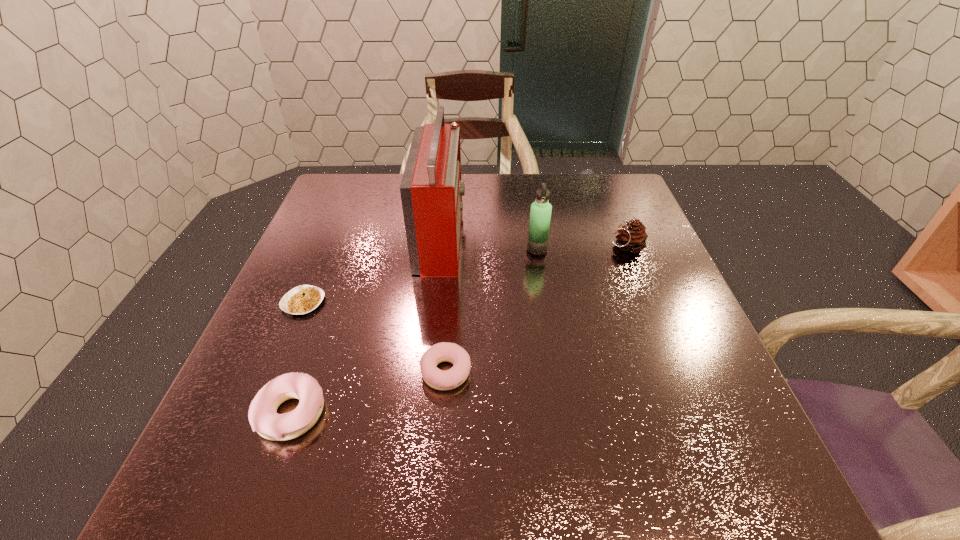
The height and width of the screenshot is (540, 960). Identify the location of vacant area that lies between the fourth shortest object and the shortest object. (465, 274).

You are a GUI agent. You are given a task and a screenshot of the screen. Output one action in this format:
    pyautogui.click(x=<x>, y=<y>)
    Task: Click on the free space between the right doughnut and the shortest object
    Image resolution: width=960 pixels, height=540 pixels.
    Given the screenshot: What is the action you would take?
    pyautogui.click(x=374, y=337)

Image resolution: width=960 pixels, height=540 pixels. Find the location of `vacant area that lies between the rightmost object and the legume`. vacant area that lies between the rightmost object and the legume is located at coordinates (465, 274).

The height and width of the screenshot is (540, 960). In order to click on free space that is in between the fifth tallest object and the thermos bottle in this screenshot , I will do `click(492, 310)`.

Where is `free spot between the taller doughnut and the tallest object`? The width and height of the screenshot is (960, 540). free spot between the taller doughnut and the tallest object is located at coordinates (366, 324).

This screenshot has height=540, width=960. I want to click on free spot between the second tallest object and the rightmost object, so click(x=581, y=248).

Identify the location of vacant area that lies between the third shortest object and the tallest object. (366, 324).

Image resolution: width=960 pixels, height=540 pixels. Find the location of `free space between the legume and the radio receiver`. free space between the legume and the radio receiver is located at coordinates (372, 269).

The width and height of the screenshot is (960, 540). Find the location of `free space that is in between the fifth tallest object and the second object from right to left`. free space that is in between the fifth tallest object and the second object from right to left is located at coordinates [x=492, y=310].

Locate which object is the fourth closest to the shortest object. Please provide its 2D coordinates. Your answer should be formatted as a tuple, i.e. [(x, y)], where the tuple contains the x and y coordinates of a point satisfying the conditions above.

[(540, 215)]